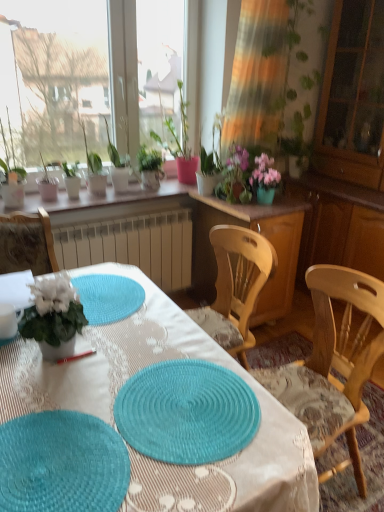
This screenshot has width=384, height=512. Find the location of `free region under teal woven mat at lower left, which is the 1th mat in left-to-right order (from a real-world perspective)`. free region under teal woven mat at lower left, which is the 1th mat in left-to-right order (from a real-world perspective) is located at coordinates (59, 465).